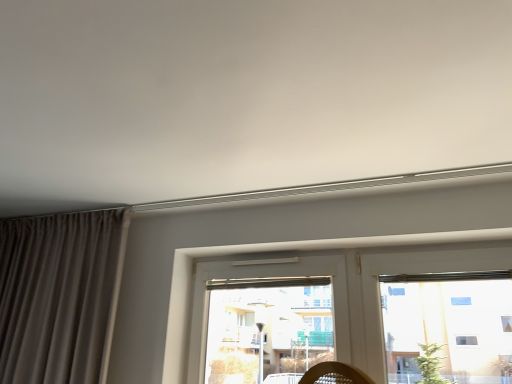
Question: Is matte gray curtain at left outside of transparent glass window at center?

Choices:
 (A) no
 (B) yes

Answer: (B)

Question: Considering the relative sizes of matte gray curtain at left and transparent glass window at center in the image provided, is matte gray curtain at left wider than transparent glass window at center?

Choices:
 (A) yes
 (B) no

Answer: (A)

Question: Is matte gray curtain at left to the left of transparent glass window at center from the viewer's perspective?

Choices:
 (A) yes
 (B) no

Answer: (A)

Question: Are matte gray curtain at left and transparent glass window at center beside each other?

Choices:
 (A) yes
 (B) no

Answer: (B)

Question: Is matte gray curtain at left far from transparent glass window at center?

Choices:
 (A) no
 (B) yes

Answer: (A)

Question: From a real-world perspective, is matte gray curtain at left below transparent glass window at center?

Choices:
 (A) yes
 (B) no

Answer: (B)

Question: Does transparent glass window at center turn towards matte gray curtain at left?

Choices:
 (A) yes
 (B) no

Answer: (B)

Question: Does transparent glass window at center have a larger size compared to matte gray curtain at left?

Choices:
 (A) no
 (B) yes

Answer: (A)

Question: Is matte gray curtain at left completely or partially inside transparent glass window at center?

Choices:
 (A) yes
 (B) no

Answer: (B)

Question: From the image's perspective, is transparent glass window at center located above matte gray curtain at left?

Choices:
 (A) yes
 (B) no

Answer: (B)

Question: Is transparent glass window at center at the left side of matte gray curtain at left?

Choices:
 (A) no
 (B) yes

Answer: (A)

Question: Is transparent glass window at center wider than matte gray curtain at left?

Choices:
 (A) no
 (B) yes

Answer: (A)

Question: Considering the positions of point (53, 296) and point (482, 354), is point (53, 296) closer or farther from the camera than point (482, 354)?

Choices:
 (A) farther
 (B) closer

Answer: (B)